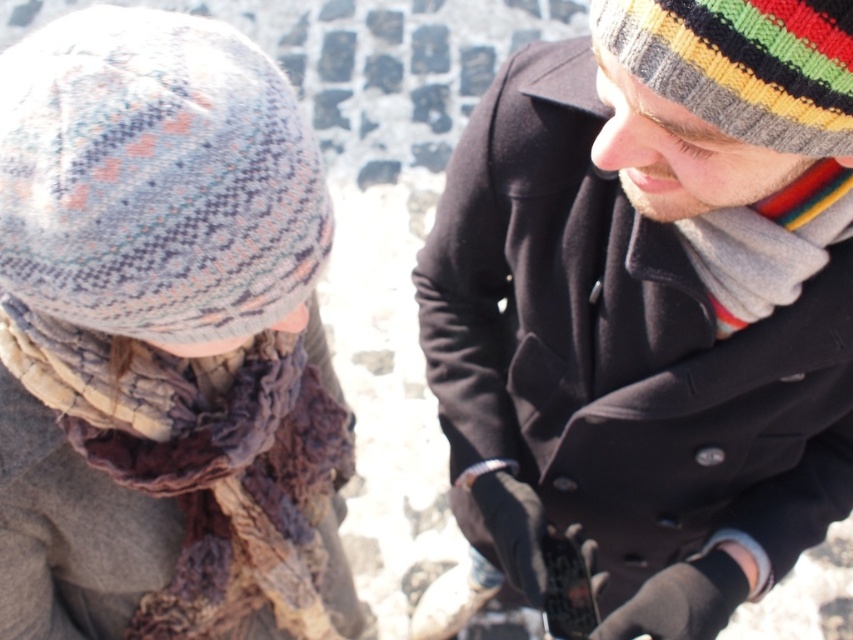
You are a fashion stylist analyzing the outfit of the person on the right in the image. Which item is placed higher on their body between the knitted woolen hat at upper right and the gray knitted scarf at right?

The knitted woolen hat at upper right is positioned over the gray knitted scarf at right, so it is placed higher on their body.

You are standing in front of the two people in the image. You want to take a photo of the point at coordinates (x=811, y=92). The camera you are using has a minimum focus distance of 25 inches. Will the camera be able to focus on that point?

The point at coordinates (x=811, y=92) is 24.88 inches away from the camera. Since the minimum focus distance is 25 inches, the camera cannot focus on that point because it is too close.

You are a photographer trying to capture the scene. You notice the knitted wool scarf at lower left and the knitted woolen hat at upper right. Which object is positioned lower in the image?

The knitted wool scarf at lower left is positioned lower than the knitted woolen hat at upper right.